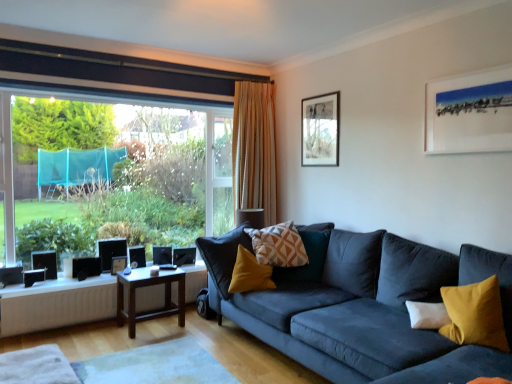
Locate an element on the screen. wooden table at lower center, acting as the 1th table starting from the top is located at coordinates (57, 304).

Locate an element on the screen. This screenshot has width=512, height=384. matte black picture frame at center, which is the 1th picture frame from bottom to top is located at coordinates [118, 264].

Describe the element at coordinates (118, 264) in the screenshot. I see `matte black picture frame at center, arranged as the 3th picture frame when viewed from the front` at that location.

The image size is (512, 384). I want to click on geometric-patterned fabric pillow at center, the 1th pillow viewed from the back, so click(278, 245).

I want to click on wooden table at lower center, which appears as the second table when ordered from the bottom, so click(57, 304).

Considering the points (430, 304) and (117, 268), which point is behind, point (430, 304) or point (117, 268)?

The point (117, 268) is farther.

Does white soft pillow at lower right, the 2th pillow positioned from the left, appear on the right side of matte black picture frame at center, marked as the 3th picture frame in a right-to-left arrangement?

Yes.

Is the surface of white soft pillow at lower right, the 2th pillow positioned from the left, in direct contact with matte black picture frame at center, placed as the first picture frame when sorted from back to front?

No, white soft pillow at lower right, the 2th pillow positioned from the left, is not in contact with matte black picture frame at center, placed as the first picture frame when sorted from back to front.

What's the angular difference between white soft pillow at lower right, acting as the first pillow starting from the bottom, and matte black picture frame at center, marked as the 3th picture frame in a right-to-left arrangement,'s facing directions?

The angular difference between white soft pillow at lower right, acting as the first pillow starting from the bottom, and matte black picture frame at center, marked as the 3th picture frame in a right-to-left arrangement, is 41.3 degrees.

Is matte black picture frame at center, marked as the 3th picture frame in a right-to-left arrangement, smaller than brown wooden table at center, the first table when ordered from bottom to top?

Indeed, matte black picture frame at center, marked as the 3th picture frame in a right-to-left arrangement, has a smaller size compared to brown wooden table at center, the first table when ordered from bottom to top.

Considering the relative positions of matte black picture frame at center, marked as the 3th picture frame in a right-to-left arrangement, and brown wooden table at center, the 2th table when ordered from top to bottom, in the image provided, is matte black picture frame at center, marked as the 3th picture frame in a right-to-left arrangement, to the left of brown wooden table at center, the 2th table when ordered from top to bottom, from the viewer's perspective?

Correct, you'll find matte black picture frame at center, marked as the 3th picture frame in a right-to-left arrangement, to the left of brown wooden table at center, the 2th table when ordered from top to bottom.

Starting from the matte black picture frame at center, placed as the first picture frame when sorted from back to front, which table is the 1st one in front? Please provide its 2D coordinates.

[(148, 286)]

Is matte black picture frame at center, arranged as the 3th picture frame when viewed from the front, thinner than brown wooden table at center, the first table when ordered from bottom to top?

Correct, the width of matte black picture frame at center, arranged as the 3th picture frame when viewed from the front, is less than that of brown wooden table at center, the first table when ordered from bottom to top.

Could you tell me if brown wooden table at center, the 2th table when ordered from top to bottom, is turned towards matte black picture frame at upper center, the 3th picture frame ordered from the bottom?

No, brown wooden table at center, the 2th table when ordered from top to bottom, is not facing towards matte black picture frame at upper center, the 3th picture frame ordered from the bottom.

From the image's perspective, which one is positioned higher, brown wooden table at center, the first table when ordered from bottom to top, or matte black picture frame at upper center, the 2th picture frame in the back-to-front sequence?

From the image's view, matte black picture frame at upper center, the 2th picture frame in the back-to-front sequence, is above.

Is brown wooden table at center, the first table when ordered from bottom to top, completely or partially outside of matte black picture frame at upper center, which ranks as the 2th picture frame in front-to-back order?

Absolutely, brown wooden table at center, the first table when ordered from bottom to top, is external to matte black picture frame at upper center, which ranks as the 2th picture frame in front-to-back order.

Can you confirm if striped fabric curtain at center is bigger than geometric-patterned fabric pillow at center, the 1th pillow viewed from the back?

Yes.

How many degrees apart are the facing directions of striped fabric curtain at center and geometric-patterned fabric pillow at center, the 2th pillow when ordered from right to left?

There is a 11.3-degree angle between the facing directions of striped fabric curtain at center and geometric-patterned fabric pillow at center, the 2th pillow when ordered from right to left.

Which of these two, striped fabric curtain at center or geometric-patterned fabric pillow at center, which is the second pillow in bottom-to-top order, stands shorter?

Standing shorter between the two is geometric-patterned fabric pillow at center, which is the second pillow in bottom-to-top order.

From the picture: Which object is further away from the camera taking this photo, striped fabric curtain at center or geometric-patterned fabric pillow at center, which is the second pillow in bottom-to-top order?

striped fabric curtain at center is more distant.

Does brown wooden table at center, the first table when ordered from bottom to top, lie behind matte black picture frame at center, marked as the 3th picture frame in a right-to-left arrangement?

No, brown wooden table at center, the first table when ordered from bottom to top, is in front of matte black picture frame at center, marked as the 3th picture frame in a right-to-left arrangement.

From the matte black picture frame at center, the third picture frame viewed from the top, count 1st tables forward and point to it. Please provide its 2D coordinates.

[(148, 286)]

Is point (168, 291) in front of point (116, 272)?

No, it is behind (116, 272).

How many degrees apart are the facing directions of brown wooden table at center, the first table when ordered from bottom to top, and matte black picture frame at center, which is the 1th picture frame from bottom to top?

The angle between the facing direction of brown wooden table at center, the first table when ordered from bottom to top, and the facing direction of matte black picture frame at center, which is the 1th picture frame from bottom to top, is 1.43 degrees.

In terms of height, does geometric-patterned fabric pillow at center, marked as the 2th pillow in a front-to-back arrangement, look taller or shorter compared to matte black picture frame at upper center, which ranks as the 2th picture frame in front-to-back order?

geometric-patterned fabric pillow at center, marked as the 2th pillow in a front-to-back arrangement, is shorter than matte black picture frame at upper center, which ranks as the 2th picture frame in front-to-back order.

How far apart are geometric-patterned fabric pillow at center, marked as the 2th pillow in a front-to-back arrangement, and matte black picture frame at upper center, which appears as the first picture frame when viewed from the top?

geometric-patterned fabric pillow at center, marked as the 2th pillow in a front-to-back arrangement, and matte black picture frame at upper center, which appears as the first picture frame when viewed from the top, are 36.41 inches apart.

Is point (268, 260) farther from viewer compared to point (309, 107)?

No, (268, 260) is closer to viewer.

In the scene shown: From a real-world perspective, is geometric-patterned fabric pillow at center, the 2th pillow when ordered from right to left, located beneath matte black picture frame at upper center, which is the second picture frame from left to right?

Yes, from a real-world perspective, geometric-patterned fabric pillow at center, the 2th pillow when ordered from right to left, is beneath matte black picture frame at upper center, which is the second picture frame from left to right.

Would you say matte black picture frame at center, which is the 1th picture frame from bottom to top, contains striped fabric curtain at center?

No, striped fabric curtain at center is not surrounded by matte black picture frame at center, which is the 1th picture frame from bottom to top.

Considering the relative positions of matte black picture frame at center, marked as the 3th picture frame in a right-to-left arrangement, and striped fabric curtain at center in the image provided, is matte black picture frame at center, marked as the 3th picture frame in a right-to-left arrangement, behind striped fabric curtain at center?

No, it is in front of striped fabric curtain at center.

Are matte black picture frame at center, which is counted as the first picture frame, starting from the left, and striped fabric curtain at center located far from each other?

Yes, matte black picture frame at center, which is counted as the first picture frame, starting from the left, and striped fabric curtain at center are located far from each other.

Locate an element on the screen. The image size is (512, 384). the 2nd picture frame to the left when counting from the white soft pillow at lower right, which is the first pillow from right to left is located at coordinates (118, 264).

This screenshot has width=512, height=384. What are the coordinates of `table on the right of the matte black picture frame at center, placed as the first picture frame when sorted from back to front` in the screenshot? It's located at (148, 286).

Based on their spatial positions, is black matte speaker at lower left, positioned as the 1th speaker in right-to-left order, or white matte radiator at lower left further from brown wooden table at center, the 2th table when ordered from top to bottom?

black matte speaker at lower left, positioned as the 1th speaker in right-to-left order.

Based on their spatial positions, is matte black picture frame at center, marked as the 3th picture frame in a right-to-left arrangement, or black matte speaker at lower left, the 2th speaker positioned from the front, closer to wooden table at lower center, which appears as the second table when ordered from the bottom?

Based on the image, black matte speaker at lower left, the 2th speaker positioned from the front, appears to be nearer to wooden table at lower center, which appears as the second table when ordered from the bottom.

Considering their positions, is white soft pillow at lower right, which is the first pillow from right to left, positioned closer to wooden table at lower center, which appears as the second table when ordered from the bottom, than black plastic speaker at lower left, arranged as the first speaker when viewed from the left?

black plastic speaker at lower left, arranged as the first speaker when viewed from the left.

Based on their spatial positions, is geometric-patterned fabric pillow at center, marked as the 1th pillow in a top-to-bottom arrangement, or black matte speaker at lower left, placed as the 3th speaker when sorted from left to right, closer to wooden table at lower center, which appears as the second table when ordered from the bottom?

black matte speaker at lower left, placed as the 3th speaker when sorted from left to right.

Which object lies nearer to the anchor point matte black picture frame at center, which is the 1th picture frame from bottom to top, transparent glass window at left or brown wooden table at center, the first table when ordered from bottom to top?

brown wooden table at center, the first table when ordered from bottom to top.

When comparing their distances from geometric-patterned fabric pillow at center, the 1th pillow when ordered from left to right, does white matte radiator at lower left or black matte speaker at lower left, which is counted as the 2th speaker, starting from the left, seem closer?

white matte radiator at lower left.

Based on their spatial positions, is white matte radiator at lower left or matte black picture frame at center, which is the 1th picture frame from bottom to top, closer to black matte speaker at lower left, the 2th speaker viewed from the back?

matte black picture frame at center, which is the 1th picture frame from bottom to top.

Considering their positions, is matte white picture frame at upper right, the first picture frame positioned from the front, positioned further to matte black picture frame at center, which is the 1th picture frame from bottom to top, than brown wooden table at center, the first table when ordered from bottom to top?

matte white picture frame at upper right, the first picture frame positioned from the front, lies further to matte black picture frame at center, which is the 1th picture frame from bottom to top, than the other object.

Identify the location of curtain between black matte speaker at lower left, marked as the third speaker in a front-to-back arrangement, and matte black picture frame at upper center, the 2th picture frame in the back-to-front sequence, in the horizontal direction. (254, 149).

Identify the location of picture frame between black matte speaker at lower left, marked as the third speaker in a front-to-back arrangement, and matte white picture frame at upper right, the 2th picture frame in the bottom-to-top sequence, from left to right. This screenshot has height=384, width=512. (320, 130).

This screenshot has height=384, width=512. In order to click on curtain located between white matte radiator at lower left and matte black picture frame at upper center, placed as the 2th picture frame when sorted from right to left, in the left-right direction in this screenshot , I will do `click(254, 149)`.

You are a GUI agent. You are given a task and a screenshot of the screen. Output one action in this format:
    pyautogui.click(x=<x>, y=<y>)
    Task: Click on the table situated between black matte speaker at lower left, placed as the 3th speaker when sorted from left to right, and white soft pillow at lower right, the 1th pillow from the front, from left to right
    
    Given the screenshot: What is the action you would take?
    tap(148, 286)